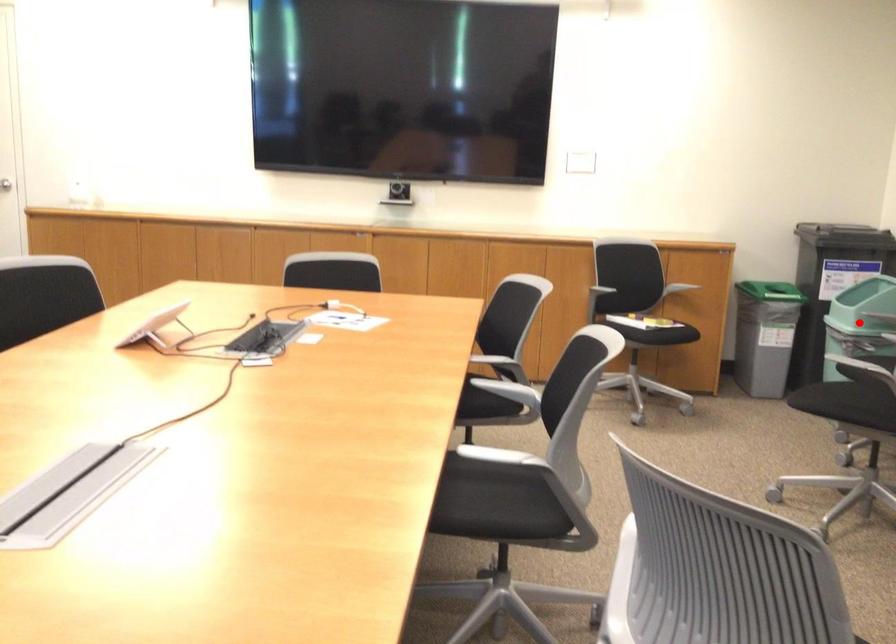
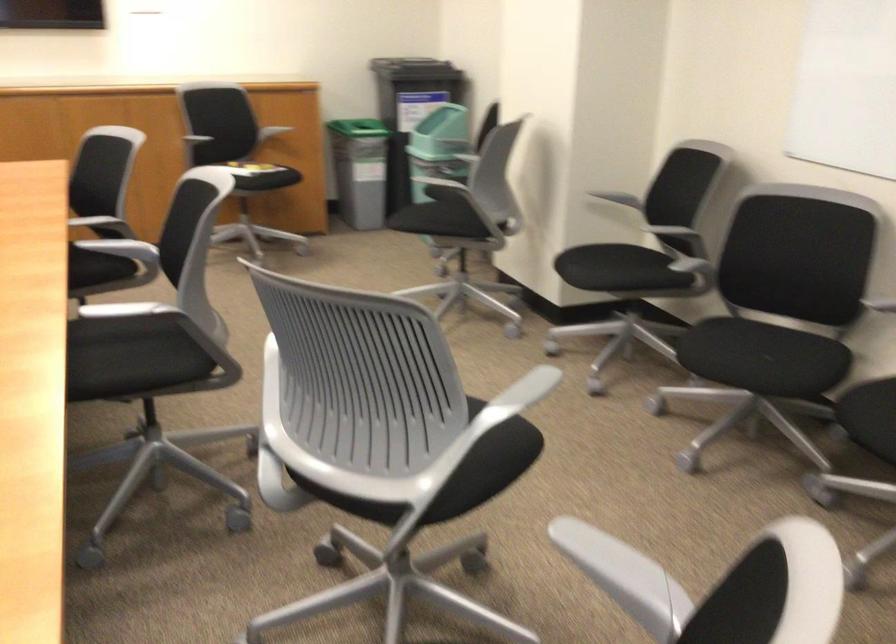
Question: I am providing you with two images of the same scene from different viewpoints. A red point is marked on the first image. At the location where the point appears in image 1, is it still visible in image 2?

Choices:
 (A) Yes
 (B) No

Answer: (B)